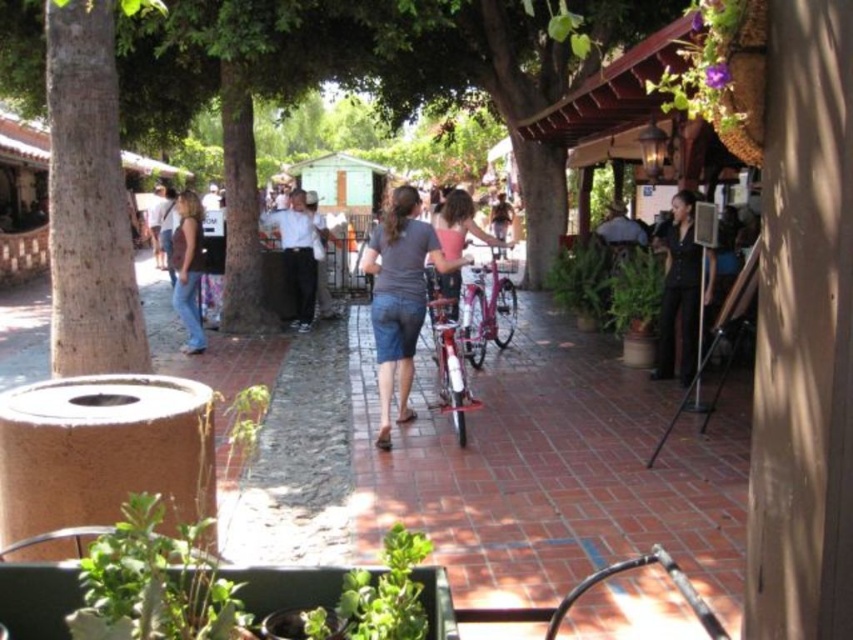
You are standing in the park and want to take a photo of two specific points marked in the scene. The first point is at coordinate point (126, 304) and the second is at point (401, 285). Which point should you focus on first to ensure it appears larger in your photo?

Point (126, 304) should be focused on first because it is closer to the viewer, making it appear larger in the photo compared to point (401, 285) which is farther away.

You are standing in the park and want to walk to the point marked as point (x=691, y=196). There is an obstacle at point (x=73, y=74). Will you encounter the obstacle before reaching your destination?

Yes, because point (x=73, y=74) is closer to the viewer than point (x=691, y=196), so you will encounter the obstacle at point (x=73, y=74) before reaching point (x=691, y=196).